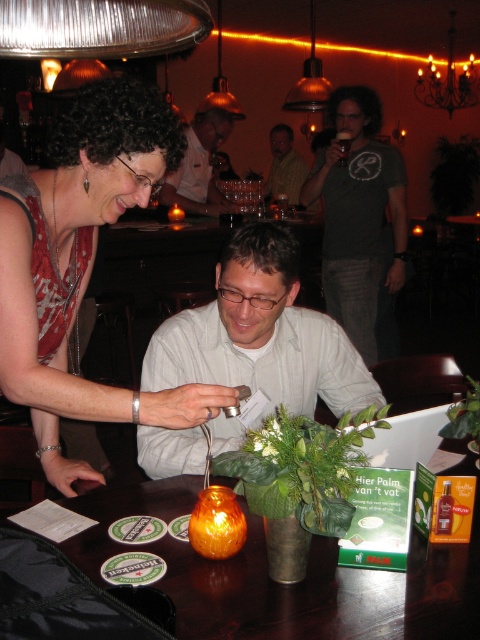
You are at a bar and see a woman in a red patterned top and a man in a light shirt. There is also a point at coordinate (83, 266). What is located at that coordinate?

The point at coordinate (83, 266) indicates the location of the matte red dress at upper left.

You are standing in the bar and want to place a small decoration on the table. There are two points on the table where you can place it. The first point is at coordinate point(x=333, y=577) and the second point is at coordinate point(x=300, y=157). Which point is closer to you?

Point(x=333, y=577) is closer to the viewer than point(x=300, y=157), so you should place the decoration there.